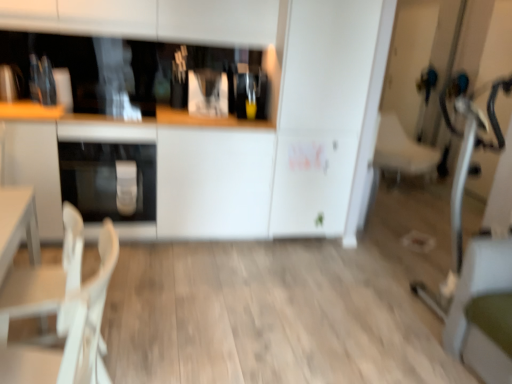
Question: Can you confirm if white plastic chair at lower left, placed as the second armchair when sorted from back to front, is shorter than satin silver oven at lower left?

Choices:
 (A) no
 (B) yes

Answer: (A)

Question: Is white plastic chair at lower left, which is the second armchair in top-to-bottom order, looking in the opposite direction of satin silver oven at lower left?

Choices:
 (A) no
 (B) yes

Answer: (A)

Question: Considering the relative positions of white plastic chair at lower left, placed as the 1th armchair when sorted from left to right, and satin silver oven at lower left in the image provided, is white plastic chair at lower left, placed as the 1th armchair when sorted from left to right, to the right of satin silver oven at lower left from the viewer's perspective?

Choices:
 (A) yes
 (B) no

Answer: (A)

Question: From the image's perspective, is white plastic chair at lower left, which is the first armchair from front to back, located above satin silver oven at lower left?

Choices:
 (A) no
 (B) yes

Answer: (A)

Question: Can you confirm if white plastic chair at lower left, marked as the first armchair in a bottom-to-top arrangement, is thinner than satin silver oven at lower left?

Choices:
 (A) yes
 (B) no

Answer: (A)

Question: In the image, is wooden counter top at center on the left side or the right side of satin silver oven at lower left?

Choices:
 (A) right
 (B) left

Answer: (A)

Question: From a real-world perspective, is wooden counter top at center above or below satin silver oven at lower left?

Choices:
 (A) below
 (B) above

Answer: (A)

Question: Choose the correct answer: Is wooden counter top at center inside satin silver oven at lower left or outside it?

Choices:
 (A) outside
 (B) inside

Answer: (A)

Question: Based on their sizes in the image, would you say wooden counter top at center is bigger or smaller than satin silver oven at lower left?

Choices:
 (A) big
 (B) small

Answer: (A)

Question: Considering the positions of wooden counter top at center and white fabric armchair at right, which is the 2th armchair in bottom-to-top order, in the image, is wooden counter top at center wider or thinner than white fabric armchair at right, which is the 2th armchair in bottom-to-top order,?

Choices:
 (A) wide
 (B) thin

Answer: (B)

Question: Looking at the image, does wooden counter top at center seem bigger or smaller compared to white fabric armchair at right, the 1th armchair viewed from the back?

Choices:
 (A) small
 (B) big

Answer: (B)

Question: Considering the positions of point (140, 236) and point (385, 158), is point (140, 236) closer or farther from the camera than point (385, 158)?

Choices:
 (A) closer
 (B) farther

Answer: (A)

Question: From a real-world perspective, relative to white fabric armchair at right, the 2th armchair positioned from the left, is wooden counter top at center vertically above or below?

Choices:
 (A) below
 (B) above

Answer: (B)

Question: From the image's perspective, is white plastic chair at lower left, placed as the second armchair when sorted from back to front, located above or below wooden counter top at center?

Choices:
 (A) above
 (B) below

Answer: (B)

Question: From a real-world perspective, relative to wooden counter top at center, is white plastic chair at lower left, marked as the first armchair in a bottom-to-top arrangement, vertically above or below?

Choices:
 (A) below
 (B) above

Answer: (A)